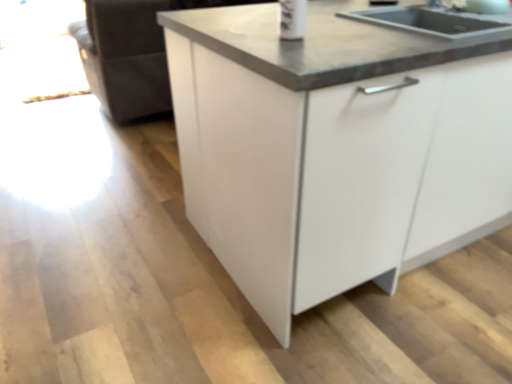
Question: Is white glossy cabinet at center inside the boundaries of black granite sink at upper right, or outside?

Choices:
 (A) outside
 (B) inside

Answer: (A)

Question: Does point (302, 238) appear closer or farther from the camera than point (349, 72)?

Choices:
 (A) farther
 (B) closer

Answer: (A)

Question: In terms of size, does white glossy cabinet at center appear bigger or smaller than black granite sink at upper right?

Choices:
 (A) small
 (B) big

Answer: (B)

Question: Looking at their shapes, would you say black granite sink at upper right is wider or thinner than white glossy cabinet at center?

Choices:
 (A) thin
 (B) wide

Answer: (A)

Question: In terms of size, does black granite sink at upper right appear bigger or smaller than white glossy cabinet at center?

Choices:
 (A) small
 (B) big

Answer: (A)

Question: Is black granite sink at upper right inside or outside of white glossy cabinet at center?

Choices:
 (A) inside
 (B) outside

Answer: (A)

Question: Based on their positions, is black granite sink at upper right located to the left or right of white glossy cabinet at center?

Choices:
 (A) right
 (B) left

Answer: (B)